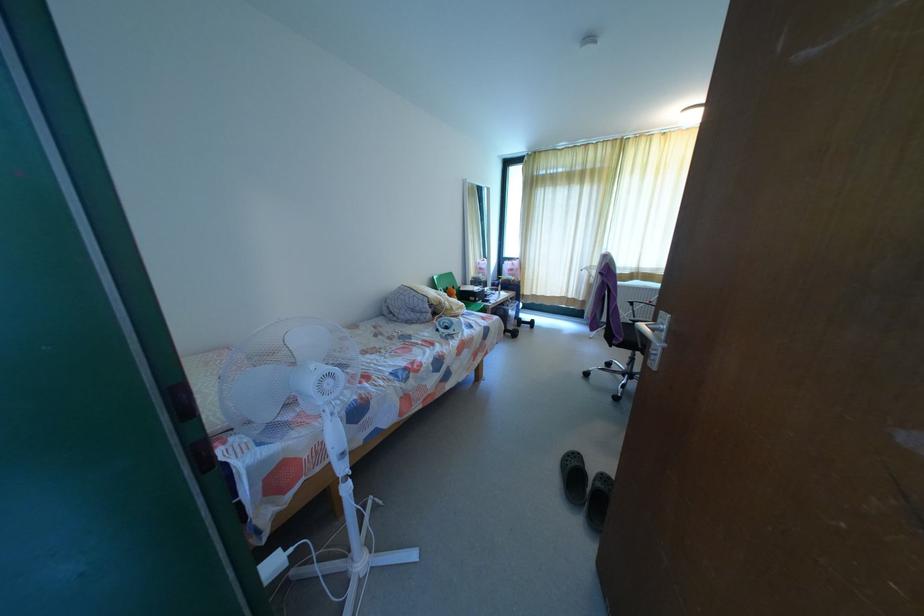
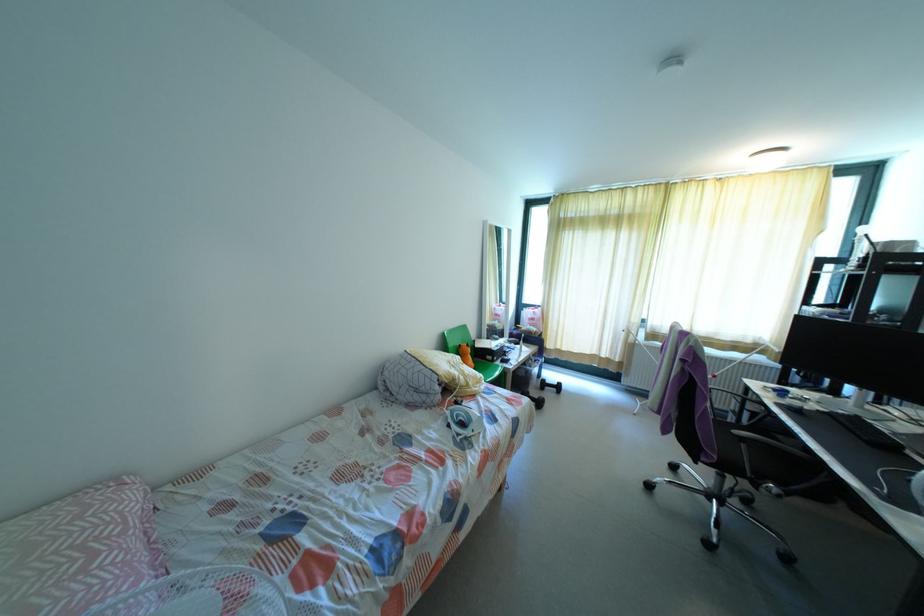
Question: Which direction would the cameraman need to move to produce the second image? Reply with the corresponding letter.

Choices:
 (A) Left
 (B) Right
 (C) Forward
 (D) Backward

Answer: (C)